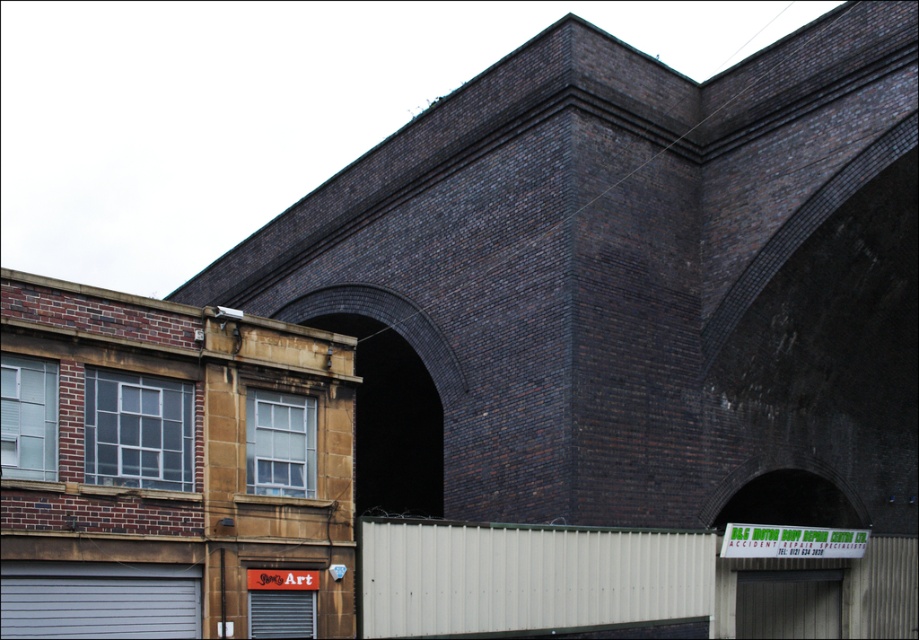
Who is more forward, (348, 332) or (46, 570)?

Positioned in front is point (46, 570).

Can you confirm if dark brick archway at center is positioned to the left of gray matte garage door at lower left?

In fact, dark brick archway at center is to the right of gray matte garage door at lower left.

Between point (399, 476) and point (166, 566), which one is positioned in front?

Point (166, 566) is more forward.

The image size is (919, 640). Identify the location of dark brick archway at center. (390, 392).